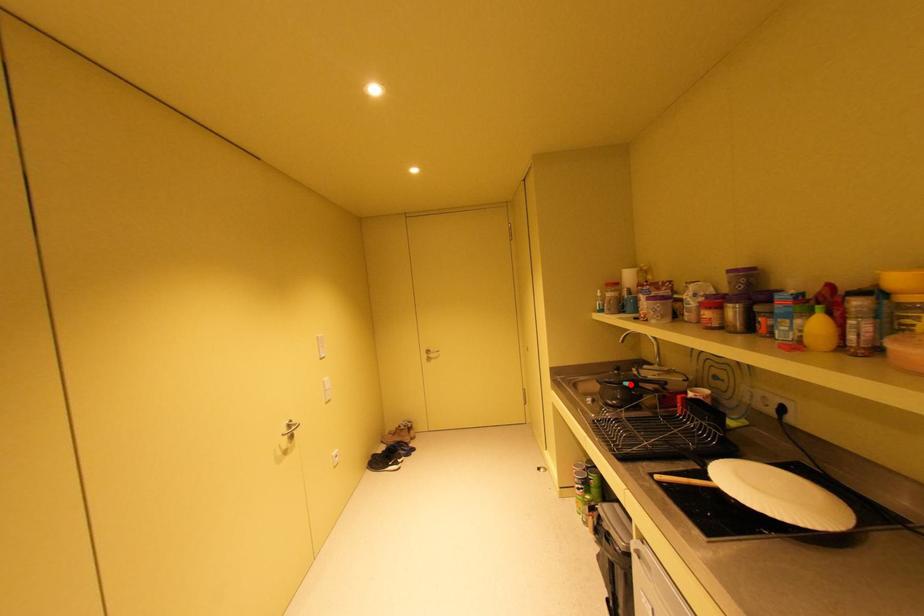
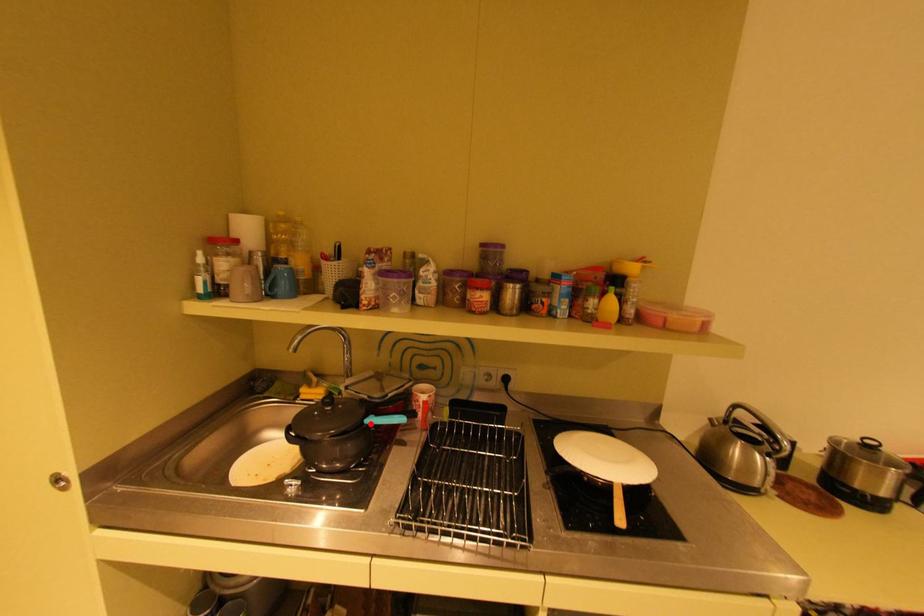
I am providing you with two images of the same scene from different viewpoints. A red point is marked on the first image and another point is marked on the second image. Is the red point in image1 aligned with the point shown in image2?

Yes